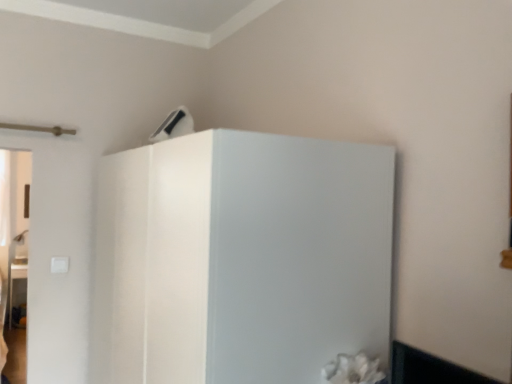
What do you see at coordinates (241, 258) in the screenshot?
I see `white glossy refrigerator at upper center` at bounding box center [241, 258].

Find the location of a particular element. This screenshot has width=512, height=384. white glossy refrigerator at upper center is located at coordinates (241, 258).

In order to click on white plastic air conditioner at upper center in this screenshot , I will do [x=174, y=125].

Describe the element at coordinates (174, 125) in the screenshot. I see `white plastic air conditioner at upper center` at that location.

In order to face white plastic air conditioner at upper center, should I rotate leftwards or rightwards?

To align with it, rotate left about 11.060°.

Where is `white glossy refrigerator at upper center`? white glossy refrigerator at upper center is located at coordinates (241, 258).

Which is more to the right, white glossy refrigerator at upper center or white plastic air conditioner at upper center?

white glossy refrigerator at upper center is more to the right.

Is white glossy refrigerator at upper center positioned in front of white plastic air conditioner at upper center?

Yes, the depth of white glossy refrigerator at upper center is less than that of white plastic air conditioner at upper center.

Between point (376, 303) and point (182, 108), which one is positioned behind?

Positioned behind is point (182, 108).

From the image's perspective, would you say white glossy refrigerator at upper center is positioned over white plastic air conditioner at upper center?

Incorrect, from the image's perspective, white glossy refrigerator at upper center is lower than white plastic air conditioner at upper center.

From a real-world perspective, does white glossy refrigerator at upper center sit lower than white plastic air conditioner at upper center?

Correct, in the physical world, white glossy refrigerator at upper center is lower than white plastic air conditioner at upper center.

Which of these two, white glossy refrigerator at upper center or white plastic air conditioner at upper center, is thinner?

white plastic air conditioner at upper center.

From their relative heights in the image, would you say white glossy refrigerator at upper center is taller or shorter than white plastic air conditioner at upper center?

white glossy refrigerator at upper center is taller than white plastic air conditioner at upper center.

Between white glossy refrigerator at upper center and white plastic air conditioner at upper center, which one has larger size?

white glossy refrigerator at upper center is bigger.

Is white plastic air conditioner at upper center a part of white glossy refrigerator at upper center?

No, white plastic air conditioner at upper center is located outside of white glossy refrigerator at upper center.

Are white glossy refrigerator at upper center and white plastic air conditioner at upper center making contact?

No, white glossy refrigerator at upper center is not next to white plastic air conditioner at upper center.

Is white glossy refrigerator at upper center facing towards white plastic air conditioner at upper center?

No, white glossy refrigerator at upper center is not turned towards white plastic air conditioner at upper center.

What's the angular difference between white glossy refrigerator at upper center and white plastic air conditioner at upper center's facing directions?

There is a 1.14-degree angle between the facing directions of white glossy refrigerator at upper center and white plastic air conditioner at upper center.

You are a GUI agent. You are given a task and a screenshot of the screen. Output one action in this format:
    pyautogui.click(x=<x>, y=<y>)
    Task: Click on the fridge to the right of white plastic air conditioner at upper center
    Image resolution: width=512 pixels, height=384 pixels.
    Given the screenshot: What is the action you would take?
    pyautogui.click(x=241, y=258)

Between white plastic air conditioner at upper center and white glossy refrigerator at upper center, which one appears on the right side from the viewer's perspective?

From the viewer's perspective, white glossy refrigerator at upper center appears more on the right side.

Relative to white glossy refrigerator at upper center, is white plastic air conditioner at upper center in front or behind?

In the image, white plastic air conditioner at upper center appears behind white glossy refrigerator at upper center.

Considering the points (165, 128) and (264, 154), which point is in front, point (165, 128) or point (264, 154)?

The point (264, 154) is closer.

From the image's perspective, would you say white plastic air conditioner at upper center is positioned over white glossy refrigerator at upper center?

Yes.

From a real-world perspective, is white plastic air conditioner at upper center physically below white glossy refrigerator at upper center?

No, from a real-world perspective, white plastic air conditioner at upper center is not below white glossy refrigerator at upper center.

Which object is thinner, white plastic air conditioner at upper center or white glossy refrigerator at upper center?

Thinner between the two is white plastic air conditioner at upper center.

In terms of height, does white plastic air conditioner at upper center look taller or shorter compared to white glossy refrigerator at upper center?

Clearly, white plastic air conditioner at upper center is shorter compared to white glossy refrigerator at upper center.

Does white plastic air conditioner at upper center have a larger size compared to white glossy refrigerator at upper center?

Actually, white plastic air conditioner at upper center might be smaller than white glossy refrigerator at upper center.

Looking at this image, is white plastic air conditioner at upper center situated inside white glossy refrigerator at upper center or outside?

The correct answer is: outside.

Is white plastic air conditioner at upper center directly adjacent to white glossy refrigerator at upper center?

No.

Is white plastic air conditioner at upper center looking in the opposite direction of white glossy refrigerator at upper center?

No, white plastic air conditioner at upper center is not facing the opposite direction of white glossy refrigerator at upper center.

Can you tell me how much white plastic air conditioner at upper center and white glossy refrigerator at upper center differ in facing direction?

There is a 1.14-degree angle between the facing directions of white plastic air conditioner at upper center and white glossy refrigerator at upper center.

Locate an element on the screen. fridge that is in front of the white plastic air conditioner at upper center is located at coordinates point(241,258).

Locate an element on the screen. fridge on the right side of white plastic air conditioner at upper center is located at coordinates (241, 258).

Image resolution: width=512 pixels, height=384 pixels. In order to click on fridge in front of the white plastic air conditioner at upper center in this screenshot , I will do `click(241, 258)`.